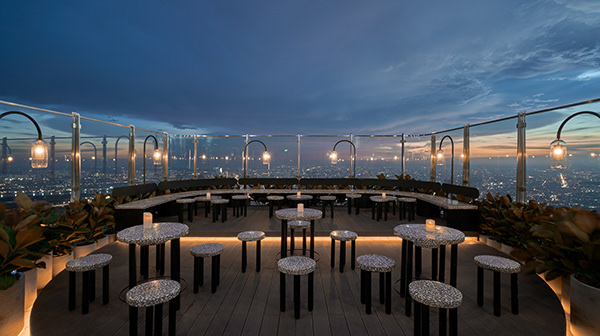
Find the location of a particular element. tables is located at coordinates (154, 230), (430, 232), (305, 217).